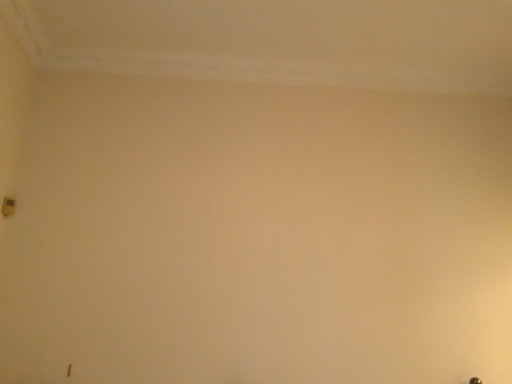
The image size is (512, 384). Describe the element at coordinates (8, 206) in the screenshot. I see `gold metallic light switch at lower left` at that location.

This screenshot has height=384, width=512. Find the location of `gold metallic light switch at lower left`. gold metallic light switch at lower left is located at coordinates (8, 206).

In order to face gold metallic light switch at lower left, should I rotate leftwards or rightwards?

Turn left by 30.150 degrees to look at gold metallic light switch at lower left.

The height and width of the screenshot is (384, 512). I want to click on gold metallic light switch at lower left, so click(x=8, y=206).